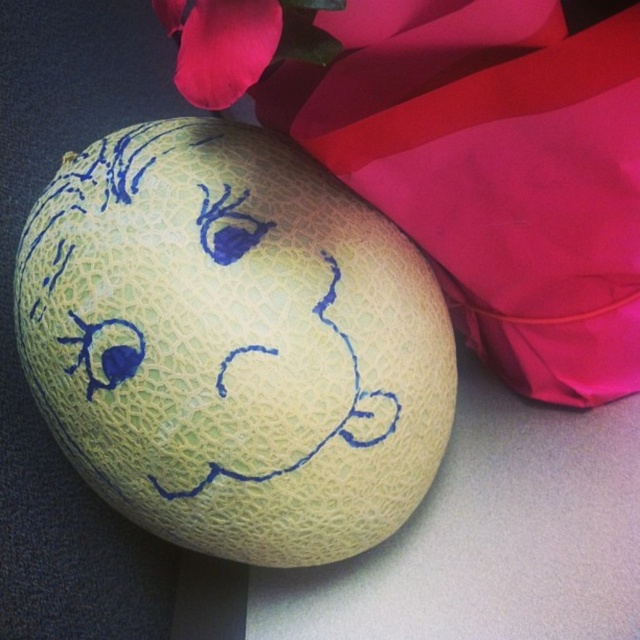
You are trying to place a small decorative item on the table. The green textured cantaloupe at center and the matte pink petal at upper left are already on the table. If the item requires a space wider than the widest object on the table, which object should you consider?

The green textured cantaloupe at center might be wider than matte pink petal at upper left, so you should consider the green textured cantaloupe at center as the widest object on the table.

You are arranging a fruit platter and need to place the green textured cantaloupe at center and the matte pink petal at upper left. Based on their positions, which object is closer to the viewer?

The matte pink petal at upper left is closer to the viewer because it is positioned above the green textured cantaloupe at center.

You are arranging flowers and see the green textured cantaloupe at center and the matte pink petal at upper left. Which object is closer to you?

The green textured cantaloupe at center is closer to you than the matte pink petal at upper left.